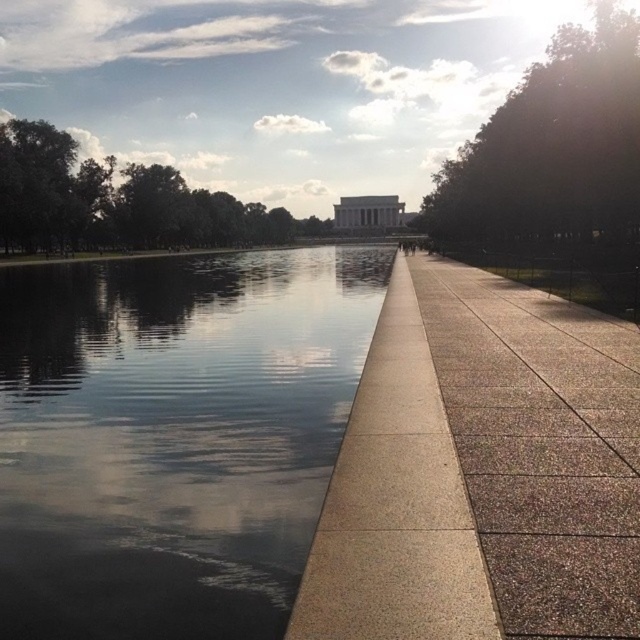
Who is positioned more to the right, glossy reflective water at center or green leafy trees at left?

glossy reflective water at center is more to the right.

Who is more forward, (262, 420) or (152, 173)?

Point (262, 420)

Which is in front, point (134, 461) or point (182, 180)?

Point (134, 461) is in front.

Locate an element on the screen. glossy reflective water at center is located at coordinates (172, 436).

Who is positioned more to the right, green leafy tree at upper right or green leafy trees at left?

Positioned to the right is green leafy tree at upper right.

Between point (584, 179) and point (3, 182), which one is positioned in front?

Positioned in front is point (584, 179).

Find the location of a particular element. The image size is (640, 640). green leafy tree at upper right is located at coordinates (552, 148).

Can you confirm if sanded concrete pavement at center is smaller than green leafy tree at upper right?

Indeed, sanded concrete pavement at center has a smaller size compared to green leafy tree at upper right.

Can you confirm if sanded concrete pavement at center is positioned to the left of green leafy tree at upper right?

Yes, sanded concrete pavement at center is to the left of green leafy tree at upper right.

This screenshot has width=640, height=640. Identify the location of sanded concrete pavement at center. (541, 448).